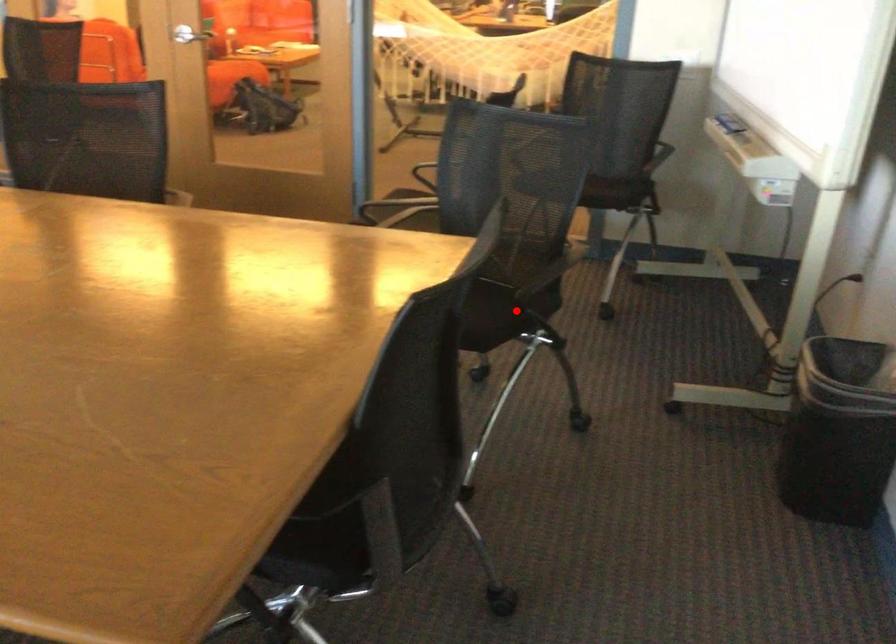
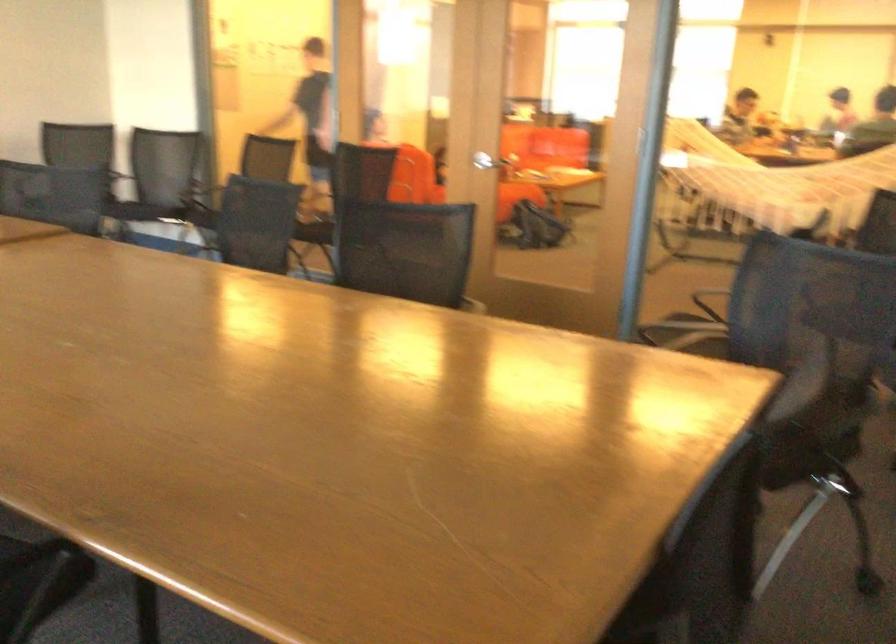
Find the pixel in the second image that matches the highlighted location in the first image.

(803, 453)